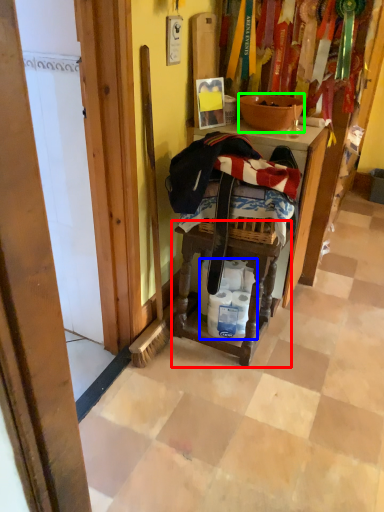
Question: Based on their relative distances, which object is farther from step stool (highlighted by a red box)? Choose from toilet paper (highlighted by a blue box) and bowl (highlighted by a green box).

Choices:
 (A) toilet paper
 (B) bowl

Answer: (B)